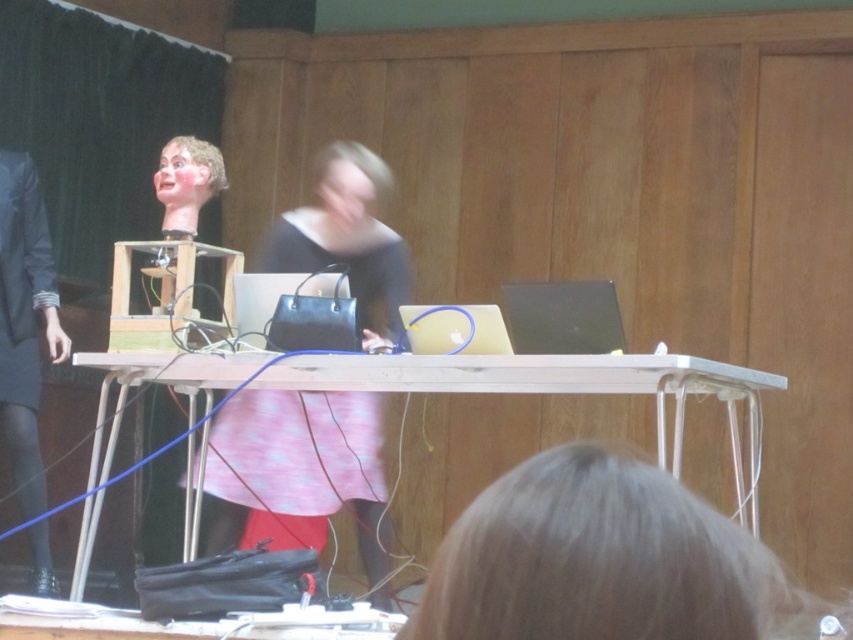
You are organizing a classroom event and need to place a decorative banner between the pink fabric skirt at center and the wooden table at center. Which object should the banner be placed closer to if you want it to be near the thinner item?

The pink fabric skirt at center is thinner than the wooden table at center, so the banner should be placed closer to the pink fabric skirt at center.

You are a fashion designer observing the items on display in the classroom. You need to determine which garment is shorter between the pink fabric skirt at center and the dark gray fabric business suit at left. Which one is shorter?

The pink fabric skirt at center is shorter than the dark gray fabric business suit at left according to the description.

You are a photographer standing at the camera position. You want to take a closeup shot of the pink fabric skirt at center. Considering the distance, is it possible to capture the skirt in focus without moving closer?

The pink fabric skirt at center is 4.06 meters away from camera. Since the skirt is relatively far away, you would need a lens with a longer focal length or adjust your camera settings to ensure it is in focus without moving closer.